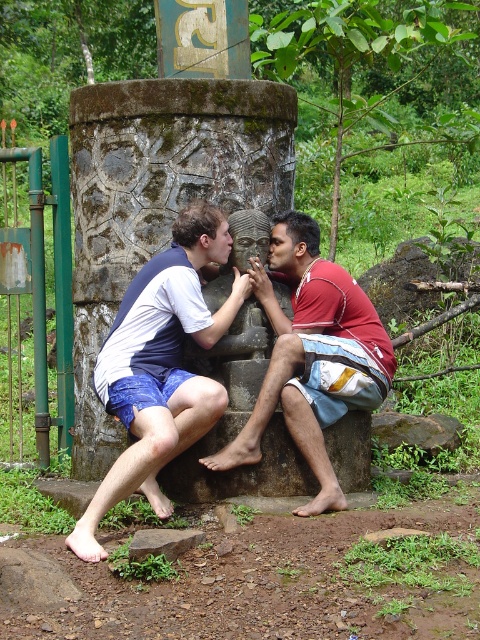
Is point (98, 516) less distant than point (384, 364)?

Yes, point (98, 516) is in front of point (384, 364).

Where is `blue denim shorts at left`? This screenshot has width=480, height=640. blue denim shorts at left is located at coordinates (160, 365).

Consider the image. Who is taller, carved stone pillar at center or brown rough rock at lower center?

Standing taller between the two is carved stone pillar at center.

Identify the location of carved stone pillar at center. (157, 196).

Which of these two, carved stone pillar at center or blue denim shorts at left, stands shorter?

With less height is carved stone pillar at center.

Does point (237, 122) come closer to viewer compared to point (190, 317)?

No.

Which is behind, point (108, 301) or point (212, 333)?

Point (108, 301)

Locate an element on the screen. Image resolution: width=480 pixels, height=640 pixels. carved stone pillar at center is located at coordinates (157, 196).